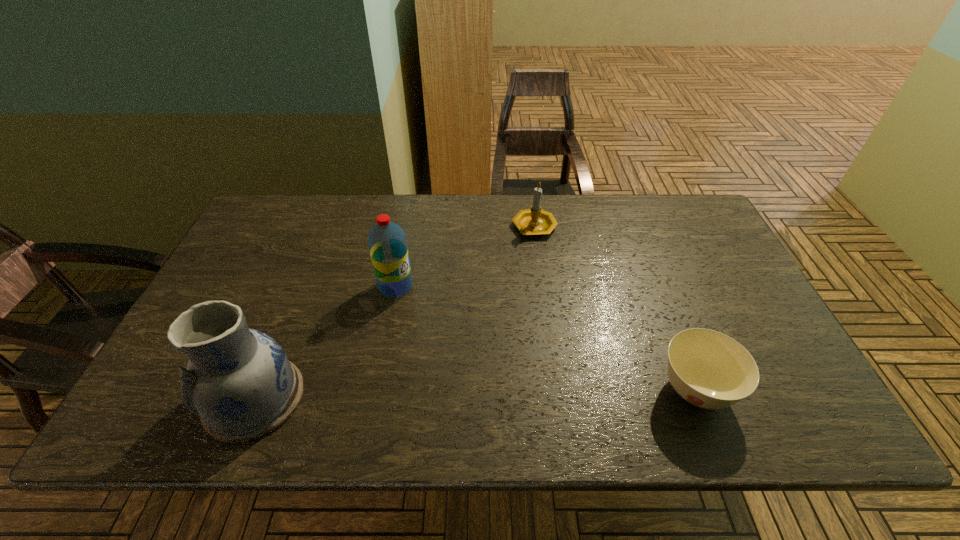
At what (x,y) coordinates should I click in order to perform the action: click on free space on the desktop that is between the leftmost object and the rightmost object and is positioned with a handle on the farthest object. Please return your answer as a coordinate pair (x, y). Looking at the image, I should click on (512, 394).

Identify the location of free space on the desktop that is between the pottery and the rightmost object and is positioned on the front label of the second object from left to right. (531, 393).